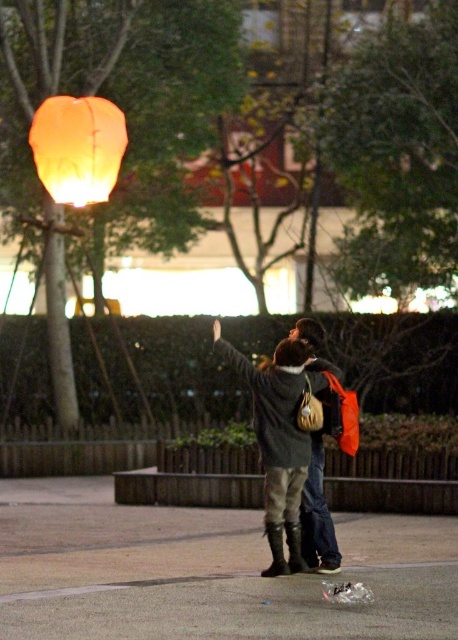
Can you confirm if leather jacket at center is positioned to the right of matte orange lantern at upper left?

Yes, leather jacket at center is to the right of matte orange lantern at upper left.

Between leather jacket at center and matte orange lantern at upper left, which one appears on the right side from the viewer's perspective?

leather jacket at center is more to the right.

Find the location of `leather jacket at center`. leather jacket at center is located at coordinates [x=289, y=449].